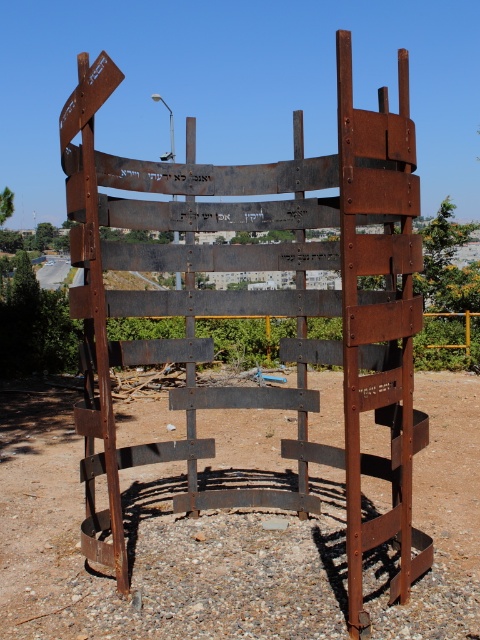
Is rusty metal sign at center thinner than rusty metal structure at center?

No, rusty metal sign at center is not thinner than rusty metal structure at center.

Is rusty metal sign at center below rusty metal structure at center?

No.

Locate an element on the screen. The height and width of the screenshot is (640, 480). rusty metal sign at center is located at coordinates (262, 307).